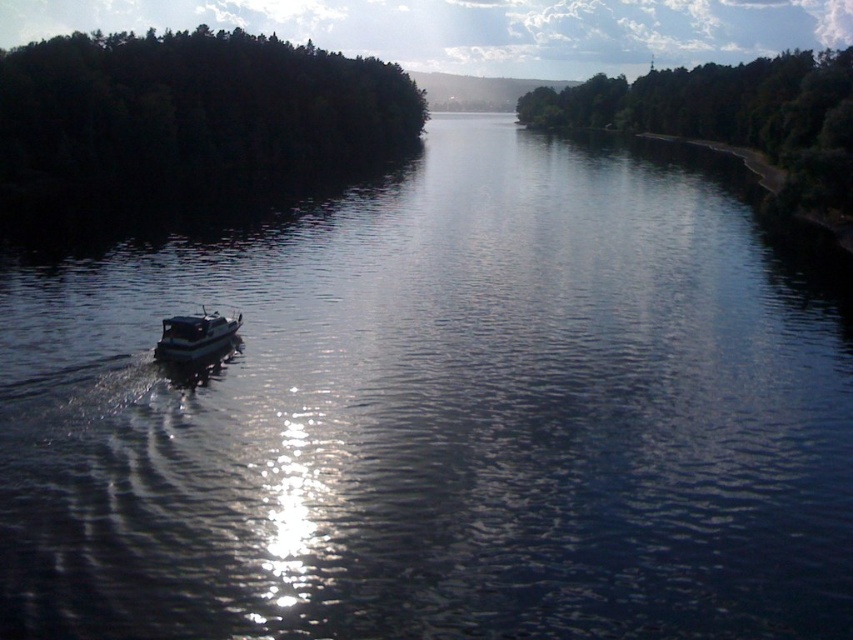
Question: Is green leafy trees at right below white glossy boat at lower left?

Choices:
 (A) no
 (B) yes

Answer: (A)

Question: Which object is farther from the camera taking this photo?

Choices:
 (A) white glossy boat at lower left
 (B) dark green forest at upper left
 (C) green leafy trees at right

Answer: (B)

Question: Considering the real-world distances, which object is closest to the green leafy trees at right?

Choices:
 (A) white glossy boat at lower left
 (B) dark green forest at upper left

Answer: (B)

Question: Which object is the closest to the dark green forest at upper left?

Choices:
 (A) green leafy trees at right
 (B) white glossy boat at lower left

Answer: (A)

Question: Is dark green forest at upper left further to camera compared to green leafy trees at right?

Choices:
 (A) yes
 (B) no

Answer: (A)

Question: Is green leafy trees at right thinner than white glossy boat at lower left?

Choices:
 (A) yes
 (B) no

Answer: (B)